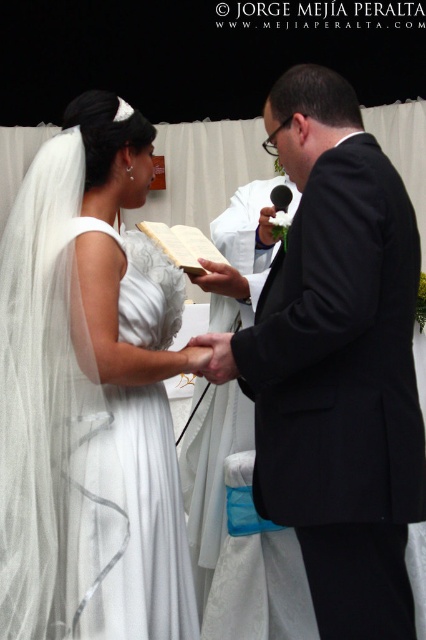
Based on the scene description, which object is taller when viewed from the front? The white satin dress at center or the white paper book at center?

The white satin dress at center is taller than the white paper book at center.

What is the 2D coordinate of the white satin dress at center in the image?

The white satin dress at center is located at the 2D coordinate point of (89, 396).

Based on the scene described, which object is positioned to the left when observing the white satin dress at center and the white paper book at center?

The white satin dress at center is to the left of the white paper book at center.